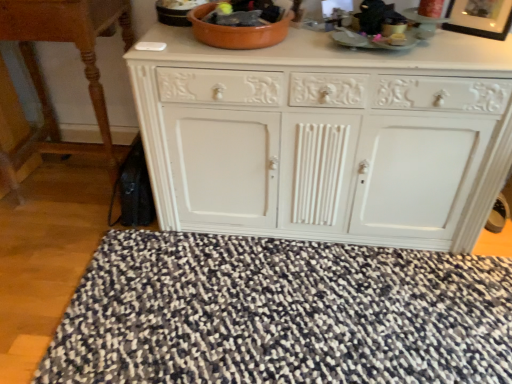
Locate an element on the screen. vacant area that is in front of black glossy picture frame at upper right is located at coordinates (485, 49).